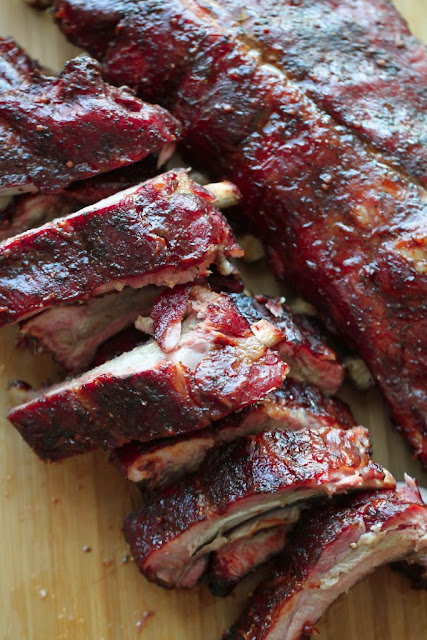
Identify the location of wood grain on cutting board. (54, 541), (22, 541), (406, 626), (382, 614).